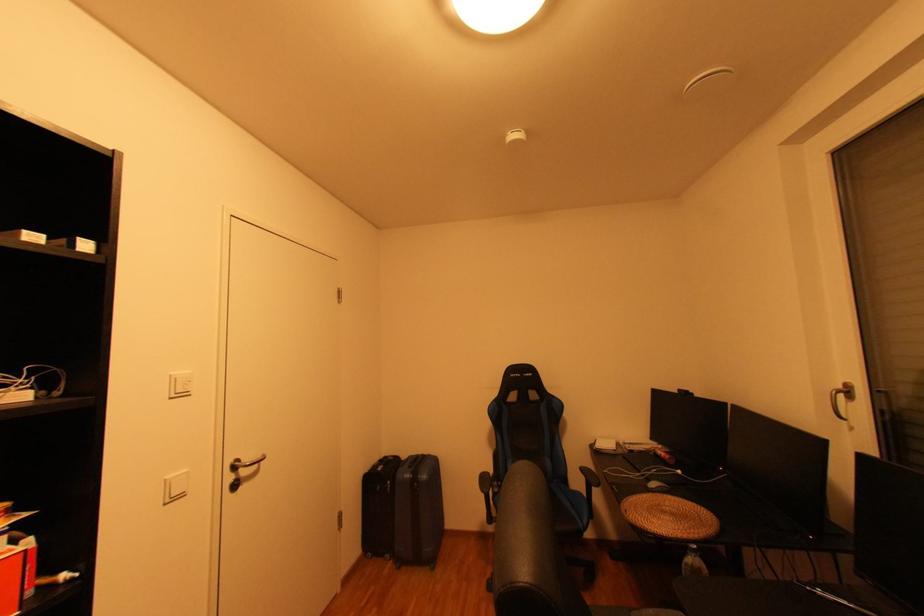
The width and height of the screenshot is (924, 616). What do you see at coordinates (179, 384) in the screenshot? I see `the white light switch` at bounding box center [179, 384].